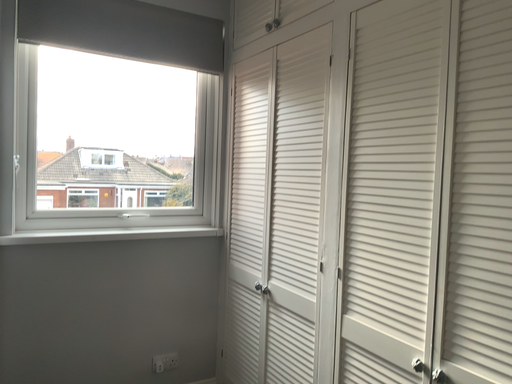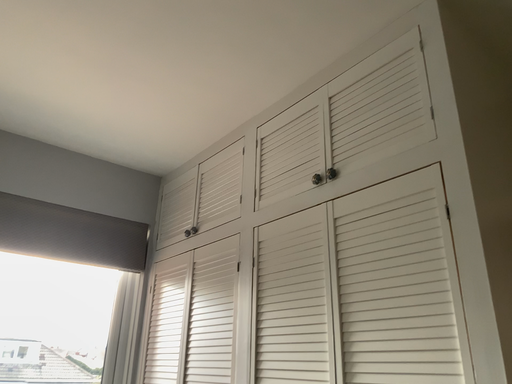
Question: How did the camera likely rotate when shooting the video?

Choices:
 (A) rotated downward
 (B) rotated upward

Answer: (B)